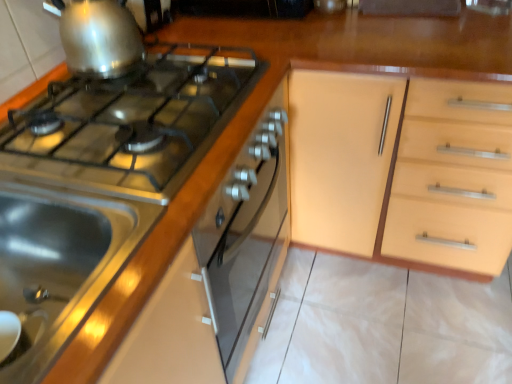
Question: Can you confirm if stainless steel stove at upper left, the second kitchen appliance when ordered from top to bottom, is taller than satin silver gas stove at left?

Choices:
 (A) yes
 (B) no

Answer: (A)

Question: Can you confirm if stainless steel stove at upper left, the second kitchen appliance when ordered from top to bottom, is bigger than satin silver gas stove at left?

Choices:
 (A) yes
 (B) no

Answer: (A)

Question: Is stainless steel stove at upper left, the second kitchen appliance when ordered from top to bottom, at the right side of satin silver gas stove at left?

Choices:
 (A) yes
 (B) no

Answer: (A)

Question: Is satin silver gas stove at left completely or partially inside stainless steel stove at upper left, the second kitchen appliance when ordered from top to bottom?

Choices:
 (A) no
 (B) yes

Answer: (B)

Question: From a real-world perspective, is stainless steel stove at upper left, which is counted as the 1th kitchen appliance, starting from the bottom, physically above satin silver gas stove at left?

Choices:
 (A) yes
 (B) no

Answer: (B)

Question: From the image's perspective, is stainless steel stove at upper left, which is counted as the 1th kitchen appliance, starting from the bottom, located above or below stainless steel sink at lower left?

Choices:
 (A) above
 (B) below

Answer: (B)

Question: Considering their positions, is stainless steel stove at upper left, which is counted as the 1th kitchen appliance, starting from the bottom, located in front of or behind stainless steel sink at lower left?

Choices:
 (A) behind
 (B) front

Answer: (B)

Question: In terms of width, does stainless steel stove at upper left, which is counted as the 1th kitchen appliance, starting from the bottom, look wider or thinner when compared to stainless steel sink at lower left?

Choices:
 (A) thin
 (B) wide

Answer: (B)

Question: Considering the positions of point (31, 365) and point (74, 327), is point (31, 365) closer or farther from the camera than point (74, 327)?

Choices:
 (A) farther
 (B) closer

Answer: (A)

Question: Considering the positions of stainless steel sink at lower left and satin silver gas stove at left in the image, is stainless steel sink at lower left wider or thinner than satin silver gas stove at left?

Choices:
 (A) thin
 (B) wide

Answer: (A)

Question: Is stainless steel sink at lower left spatially inside satin silver gas stove at left, or outside of it?

Choices:
 (A) outside
 (B) inside

Answer: (A)

Question: Considering the positions of stainless steel sink at lower left and satin silver gas stove at left in the image, is stainless steel sink at lower left bigger or smaller than satin silver gas stove at left?

Choices:
 (A) small
 (B) big

Answer: (B)

Question: Is stainless steel sink at lower left taller or shorter than satin silver gas stove at left?

Choices:
 (A) short
 (B) tall

Answer: (B)

Question: In terms of height, does stainless steel sink at lower left look taller or shorter compared to shiny metallic kettle at upper left, which is counted as the 2th kitchen appliance, starting from the bottom?

Choices:
 (A) short
 (B) tall

Answer: (B)

Question: From a real-world perspective, relative to shiny metallic kettle at upper left, which is counted as the 2th kitchen appliance, starting from the bottom, is stainless steel sink at lower left vertically above or below?

Choices:
 (A) above
 (B) below

Answer: (B)